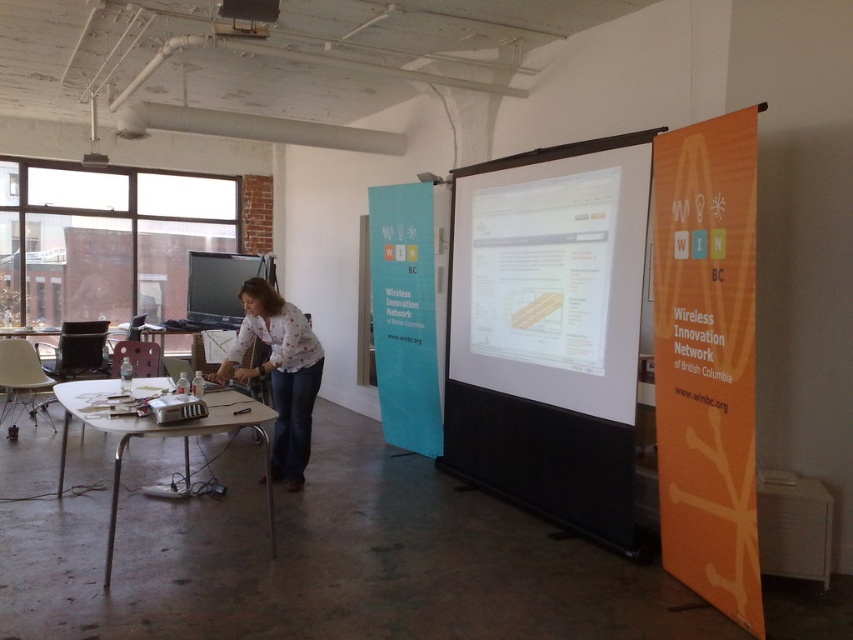
You are standing in the workshop and want to hang a new banner between the two existing points, point (x=271, y=540) and point (x=196, y=280). Which point is closer to you so you can start hanging the banner from there?

Point (x=271, y=540) is closer to the viewer than point (x=196, y=280), so you should start hanging the banner from point (x=271, y=540).

You are setting up for a presentation and need to place both the white matte projection screen at center and the white printed shirt at center on a table. Which object should you place first to ensure they both fit on the table?

The white matte projection screen at center has a larger width than the white printed shirt at center, so you should place the larger screen first to ensure there is enough space for both items on the table.

You are setting up for a presentation and need to ensure the white printed shirt at center is visible. Is the white matte projection screen at center blocking it?

The white matte projection screen at center is positioned over the white printed shirt at center, so it is blocking the shirt.